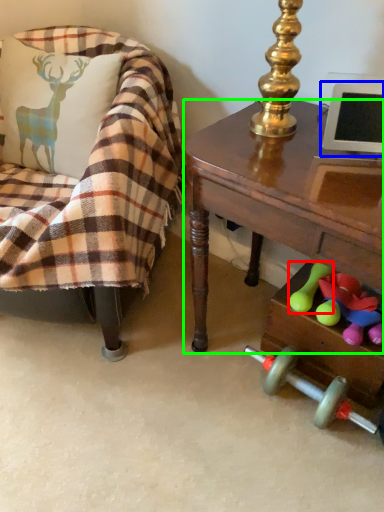
Question: Estimate the real-world distances between objects in this image. Which object is closer to toy (highlighted by a red box), computer monitor (highlighted by a blue box) or desk (highlighted by a green box)?

Choices:
 (A) computer monitor
 (B) desk

Answer: (B)